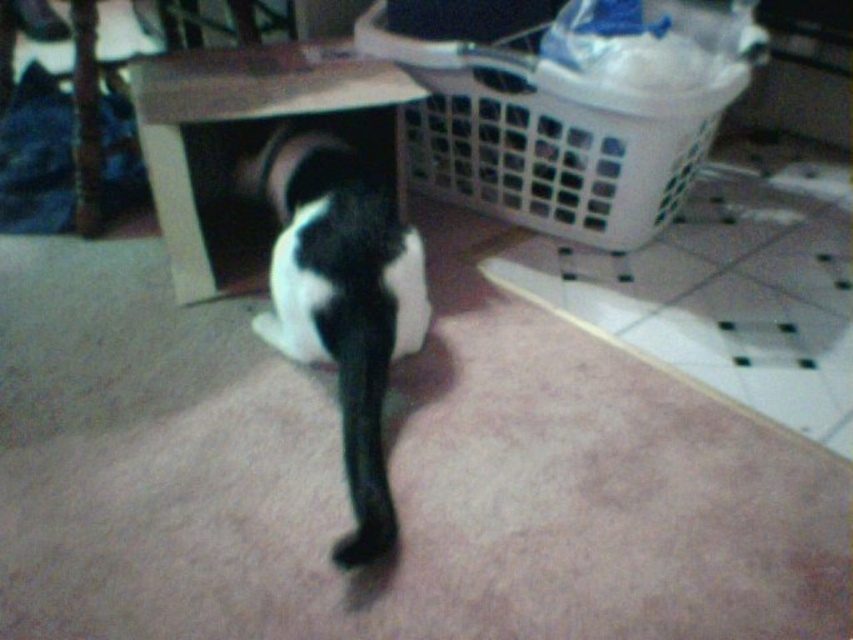
Looking at this image, is black fur cat at center positioned behind matte cardboard box at center?

No, black fur cat at center is closer to the viewer.

Is black fur cat at center wider than matte cardboard box at center?

No.

Find the location of a particular element. This screenshot has width=853, height=640. black fur cat at center is located at coordinates (341, 301).

Locate an element on the screen. white plastic laundry basket at upper right is located at coordinates (547, 134).

Who is taller, white plastic laundry basket at upper right or black fur cat at center?

black fur cat at center

Where is `white plastic laundry basket at upper right`? white plastic laundry basket at upper right is located at coordinates (547, 134).

The image size is (853, 640). What do you see at coordinates (547, 134) in the screenshot?
I see `white plastic laundry basket at upper right` at bounding box center [547, 134].

Between white plastic laundry basket at upper right and matte cardboard box at center, which one is positioned lower?

Positioned lower is matte cardboard box at center.

Is point (450, 72) in front of point (198, 244)?

No, it is not.

The width and height of the screenshot is (853, 640). I want to click on white plastic laundry basket at upper right, so click(547, 134).